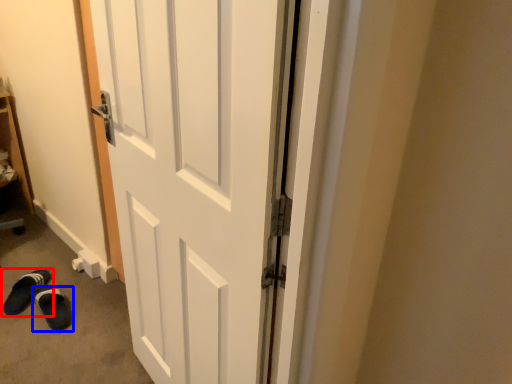
Question: Which of the following is the closest to the observer, footwear (highlighted by a red box) or footwear (highlighted by a blue box)?

Choices:
 (A) footwear
 (B) footwear

Answer: (B)